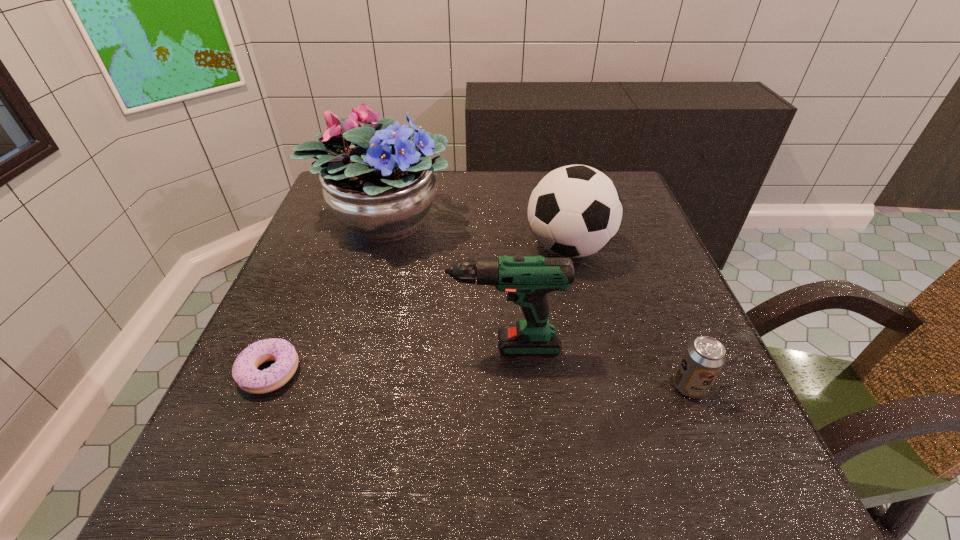
Locate an element on the screen. The image size is (960, 540). free space located on the left of the soccer ball is located at coordinates pos(491,248).

I want to click on vacant space situated 0.350m on the back of the rightmost object, so click(632, 248).

The height and width of the screenshot is (540, 960). Find the location of `vacant space located on the back of the doughnut`. vacant space located on the back of the doughnut is located at coordinates (295, 313).

Identify the location of object positioned at the far edge. (381, 189).

You are a GUI agent. You are given a task and a screenshot of the screen. Output one action in this format:
    pyautogui.click(x=<x>, y=<y>)
    Task: Click on the bouquet that is at the left edge
    The height and width of the screenshot is (540, 960).
    Given the screenshot: What is the action you would take?
    pyautogui.click(x=381, y=189)

In order to click on doughnut positioned at the left edge in this screenshot , I will do `click(245, 372)`.

I want to click on soccer ball positioned at the right edge, so click(x=574, y=211).

The height and width of the screenshot is (540, 960). Find the location of `beer can that is at the right edge`. beer can that is at the right edge is located at coordinates (704, 357).

Locate an element on the screen. object that is at the far left corner is located at coordinates point(381,189).

Where is `free spot at the far edge of the desktop`? Image resolution: width=960 pixels, height=540 pixels. free spot at the far edge of the desktop is located at coordinates (503, 216).